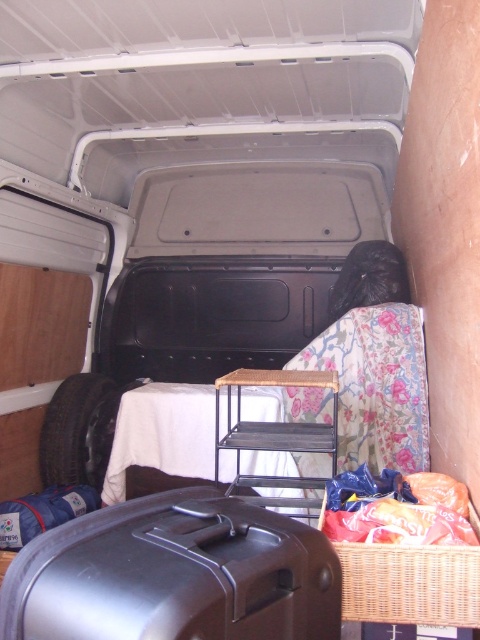
You are moving into a new apartment and need to load your furniture into this van. You have a floral fabric chair at center and a woven brown basket at lower right that you want to place inside. Given that the van has a loading width of 2 meters, will these two items fit side by side in the van?

The floral fabric chair at center and woven brown basket at lower right are 2.17 meters apart, which exceeds the van loading width of 2 meters. Therefore, they cannot fit side by side in the van.

You are moving into a new apartment and need to load your belongings into the van shown. You have a large box that needs to be placed in the van. Where should you place it so it doesn not block the floral fabric chair at center and the woven brown basket at lower right?

The woven brown basket at lower right is behind the floral fabric chair at center, so placing the large box in front of the floral fabric chair at center would block both objects. To avoid blocking them, place the large box either to the side of the floral fabric chair at center or behind the woven brown basket at lower right.

You are trying to load a heavy box into the van. The shiny black suitcase at lower center and the black rubber tire at left are in the way. Which object should you move first to make space?

You should move the shiny black suitcase at lower center first because it is positioned over the black rubber tire at left, meaning it is closer to you and easier to access.